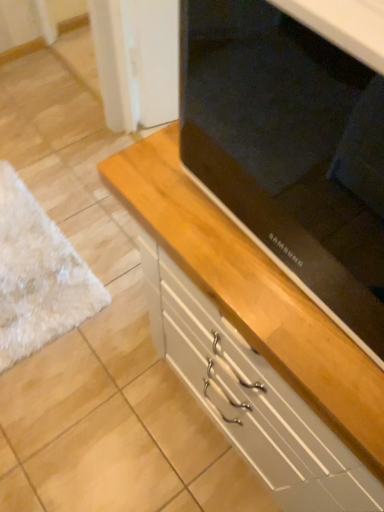
Question: Considering the relative sizes of matte black tv at center and wooden cabinet at center in the image provided, is matte black tv at center smaller than wooden cabinet at center?

Choices:
 (A) yes
 (B) no

Answer: (A)

Question: Is wooden cabinet at center inside matte black tv at center?

Choices:
 (A) yes
 (B) no

Answer: (B)

Question: Considering the relative sizes of matte black tv at center and wooden cabinet at center in the image provided, is matte black tv at center wider than wooden cabinet at center?

Choices:
 (A) no
 (B) yes

Answer: (A)

Question: Is matte black tv at center positioned with its back to wooden cabinet at center?

Choices:
 (A) yes
 (B) no

Answer: (B)

Question: From a real-world perspective, is matte black tv at center below wooden cabinet at center?

Choices:
 (A) no
 (B) yes

Answer: (A)

Question: Is matte black tv at center next to wooden cabinet at center and touching it?

Choices:
 (A) yes
 (B) no

Answer: (B)

Question: Does wooden cabinet at center have a lesser width compared to matte black tv at center?

Choices:
 (A) yes
 (B) no

Answer: (B)

Question: Does wooden cabinet at center appear on the right side of matte black tv at center?

Choices:
 (A) yes
 (B) no

Answer: (B)

Question: Can you confirm if wooden cabinet at center is positioned to the left of matte black tv at center?

Choices:
 (A) no
 (B) yes

Answer: (B)

Question: Does wooden cabinet at center have a larger size compared to matte black tv at center?

Choices:
 (A) no
 (B) yes

Answer: (B)

Question: Are wooden cabinet at center and matte black tv at center located far from each other?

Choices:
 (A) no
 (B) yes

Answer: (A)

Question: From a real-world perspective, is wooden cabinet at center located higher than matte black tv at center?

Choices:
 (A) yes
 (B) no

Answer: (B)

Question: In the image, is wooden cabinet at center positioned in front of or behind matte black tv at center?

Choices:
 (A) front
 (B) behind

Answer: (B)